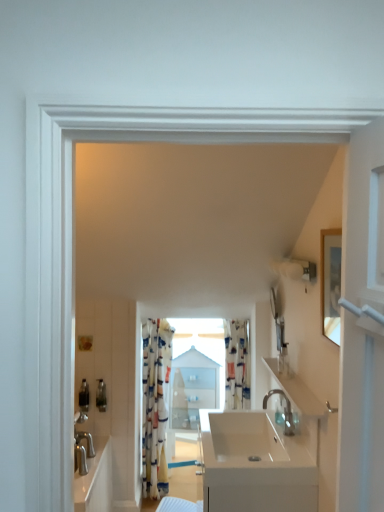
Question: Is patterned fabric curtain at center, placed as the 2th curtain when sorted from right to left, wider or thinner than white glossy sink at center?

Choices:
 (A) wide
 (B) thin

Answer: (B)

Question: From the image's perspective, is patterned fabric curtain at center, placed as the 2th curtain when sorted from right to left, located above or below white glossy sink at center?

Choices:
 (A) above
 (B) below

Answer: (A)

Question: Estimate the real-world distances between objects in this image. Which object is farther from the matte plastic soap dispenser at upper right, the second toiletry when ordered from bottom to top?

Choices:
 (A) printed fabric curtain at center, which ranks as the first curtain in right-to-left order
 (B) white glossy sink at center
 (C) metallic silver toiletry at lower left, which is the second toiletry from top to bottom
 (D) satin nickel faucet at sink right
 (E) glossy white mirror at upper right

Answer: (C)

Question: Which of these objects is positioned closest to the matte plastic soap dispenser at upper right, acting as the first toiletry starting from the front?

Choices:
 (A) transparent glass window at center
 (B) white glossy sink at center
 (C) satin nickel faucet at sink right
 (D) glossy white mirror at upper right
 (E) metallic silver toiletry at lower left, the 1th toiletry when ordered from bottom to top

Answer: (D)